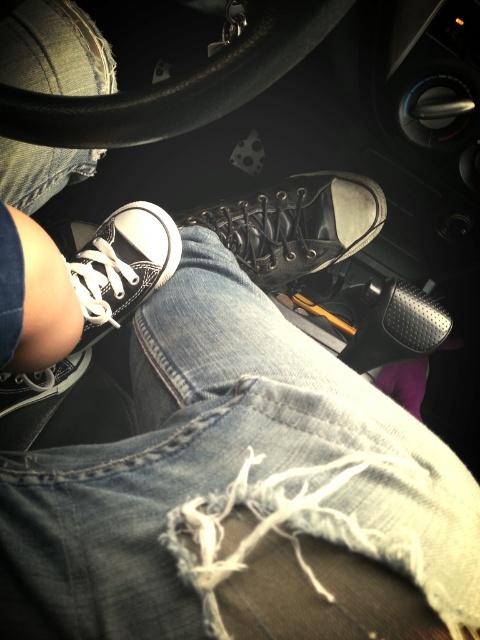
Is leather/black shoe at center thinner than denim at center?

No.

Between leather/black shoe at center and denim at center, which one has less height?

Standing shorter between the two is leather/black shoe at center.

What are the coordinates of `leather/black shoe at center` in the screenshot? It's located at (296, 225).

You are a GUI agent. You are given a task and a screenshot of the screen. Output one action in this format:
    pyautogui.click(x=<x>, y=<y>)
    Task: Click on the leather/black shoe at center
    The image size is (480, 640).
    Given the screenshot: What is the action you would take?
    pyautogui.click(x=296, y=225)

Who is higher up, leather/black shoe at center or black matte shoe at center?

leather/black shoe at center is above.

Is leather/black shoe at center taller than black matte shoe at center?

Indeed, leather/black shoe at center has a greater height compared to black matte shoe at center.

Is point (296, 204) farther from camera compared to point (443, 330)?

Yes, point (296, 204) is behind point (443, 330).

Identify the location of leather/black shoe at center. This screenshot has height=640, width=480. (296, 225).

Where is `leather/black shoe at center`? This screenshot has height=640, width=480. leather/black shoe at center is located at coordinates (296, 225).

Is leather/black shoe at center positioned behind white canvas shoe at lower left?

Yes, leather/black shoe at center is further from the viewer.

Between point (296, 204) and point (123, 248), which one is positioned behind?

The point (296, 204) is behind.

You are a GUI agent. You are given a task and a screenshot of the screen. Output one action in this format:
    pyautogui.click(x=<x>, y=<y>)
    Task: Click on the leather/black shoe at center
    The height and width of the screenshot is (640, 480).
    Given the screenshot: What is the action you would take?
    pyautogui.click(x=296, y=225)